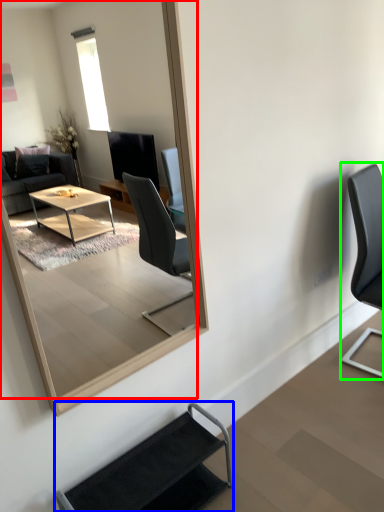
Question: Considering the real-world distances, which object is closest to mirror (highlighted by a red box)? chair (highlighted by a blue box) or chair (highlighted by a green box).

Choices:
 (A) chair
 (B) chair

Answer: (B)